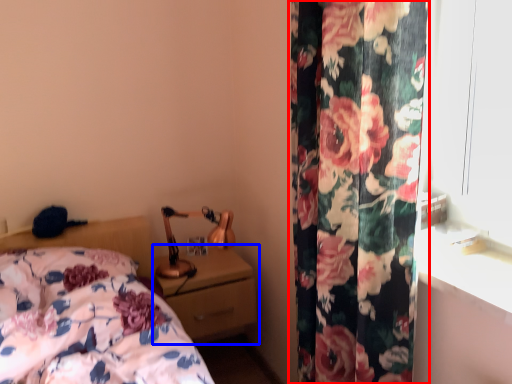
Question: Among these objects, which one is farthest to the camera, curtain (highlighted by a red box) or nightstand (highlighted by a blue box)?

Choices:
 (A) curtain
 (B) nightstand

Answer: (B)